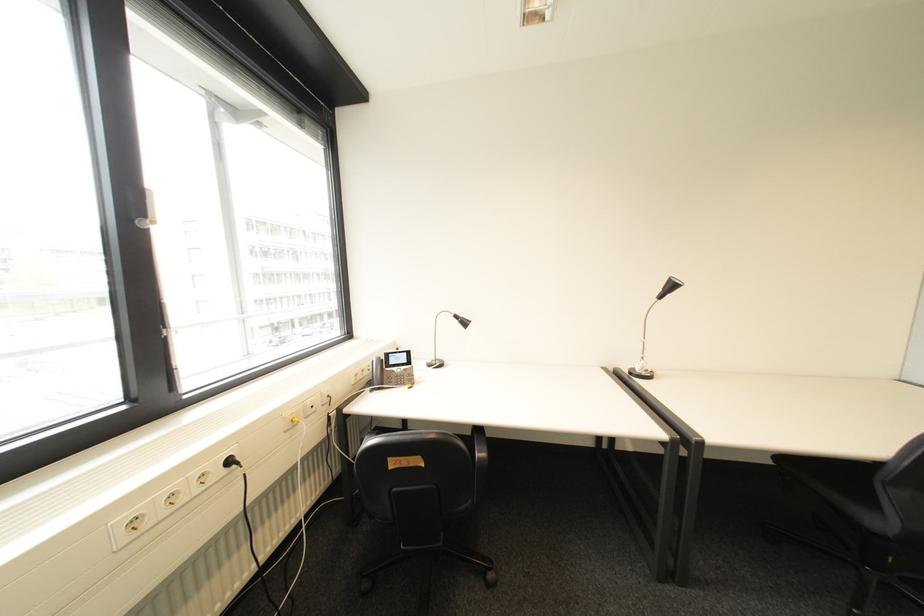
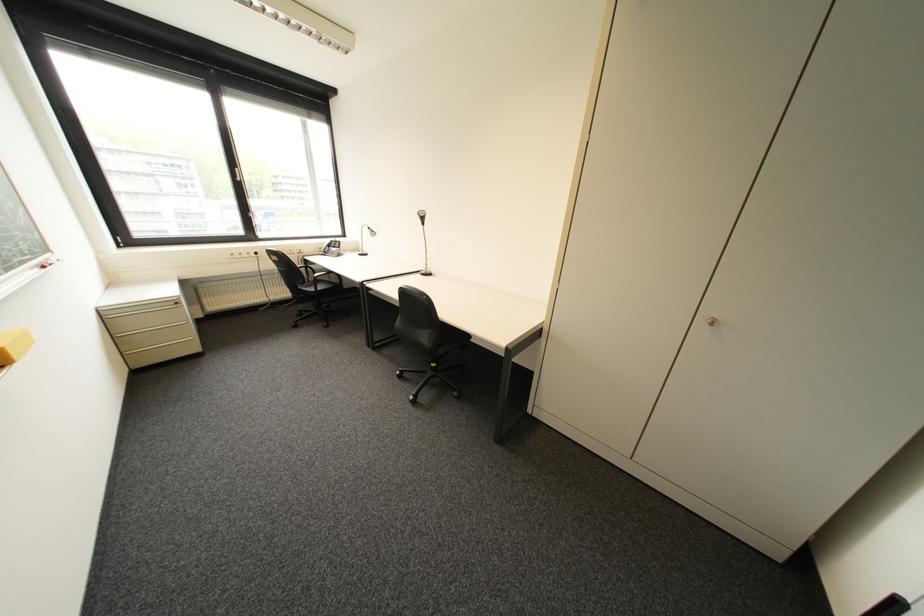
In the second image, find the point that corresponds to pixel 377 586 in the first image.

(309, 314)